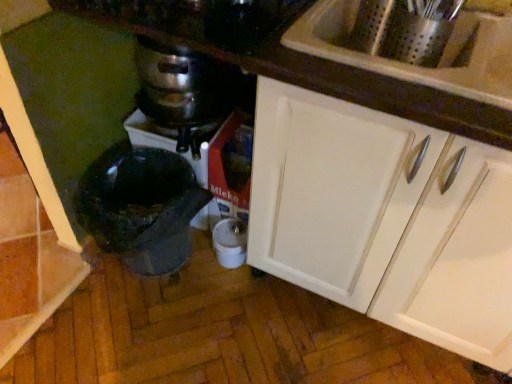
The image size is (512, 384). I want to click on empty space that is in between white plastic container at lower center, the first appliance in the right-to-left sequence, and black matte mortar at lower left, placed as the 1th appliance when sorted from left to right, so click(x=207, y=280).